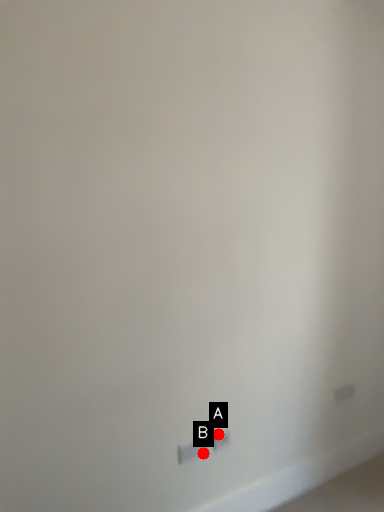
Question: Two points are circled on the image, labeled by A and B beside each circle. Which of the following is the farthest from the observer?

Choices:
 (A) A is further
 (B) B is further

Answer: (A)